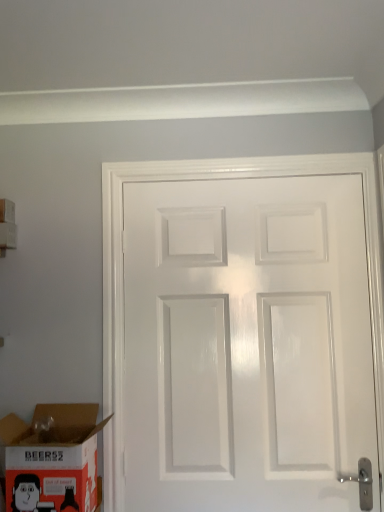
Question: Can you confirm if white cardboard box at upper left, which is the 1th box in back-to-front order, is wider than white glossy door at center?

Choices:
 (A) no
 (B) yes

Answer: (B)

Question: Is white cardboard box at upper left, which is the 1th box in back-to-front order, surrounding white glossy door at center?

Choices:
 (A) no
 (B) yes

Answer: (A)

Question: Is white cardboard box at upper left, positioned as the first box in left-to-right order, not inside white glossy door at center?

Choices:
 (A) no
 (B) yes

Answer: (B)

Question: Is the surface of white cardboard box at upper left, which is the second box in front-to-back order, in direct contact with white glossy door at center?

Choices:
 (A) yes
 (B) no

Answer: (B)

Question: Is white cardboard box at upper left, the second box in the right-to-left sequence, to the left of white glossy door at center from the viewer's perspective?

Choices:
 (A) no
 (B) yes

Answer: (B)

Question: From the image's perspective, is cardboard box at lower left, marked as the 1th box in a right-to-left arrangement, located above or below white glossy door at center?

Choices:
 (A) above
 (B) below

Answer: (B)

Question: Considering the positions of cardboard box at lower left, the 1th box when ordered from bottom to top, and white glossy door at center in the image, is cardboard box at lower left, the 1th box when ordered from bottom to top, wider or thinner than white glossy door at center?

Choices:
 (A) wide
 (B) thin

Answer: (A)

Question: Based on their positions, is cardboard box at lower left, positioned as the 2th box in left-to-right order, located to the left or right of white glossy door at center?

Choices:
 (A) right
 (B) left

Answer: (B)

Question: Is cardboard box at lower left, marked as the 1th box in a right-to-left arrangement, inside or outside of white glossy door at center?

Choices:
 (A) inside
 (B) outside

Answer: (B)

Question: Considering their positions, is white glossy door at center located in front of or behind cardboard box at lower left, positioned as the 2th box in left-to-right order?

Choices:
 (A) behind
 (B) front

Answer: (A)

Question: In the image, is white glossy door at center on the left side or the right side of cardboard box at lower left, marked as the second box in a back-to-front arrangement?

Choices:
 (A) left
 (B) right

Answer: (B)

Question: From the image's perspective, is white glossy door at center positioned above or below cardboard box at lower left, marked as the second box in a back-to-front arrangement?

Choices:
 (A) below
 (B) above

Answer: (B)

Question: Considering the positions of white glossy door at center and cardboard box at lower left, which is the second box in top-to-bottom order, in the image, is white glossy door at center taller or shorter than cardboard box at lower left, which is the second box in top-to-bottom order,?

Choices:
 (A) short
 (B) tall

Answer: (B)

Question: Considering the positions of point (218, 368) and point (8, 200), is point (218, 368) closer or farther from the camera than point (8, 200)?

Choices:
 (A) farther
 (B) closer

Answer: (B)

Question: Would you say white glossy door at center is inside or outside white cardboard box at upper left, marked as the first box in a top-to-bottom arrangement?

Choices:
 (A) inside
 (B) outside

Answer: (B)